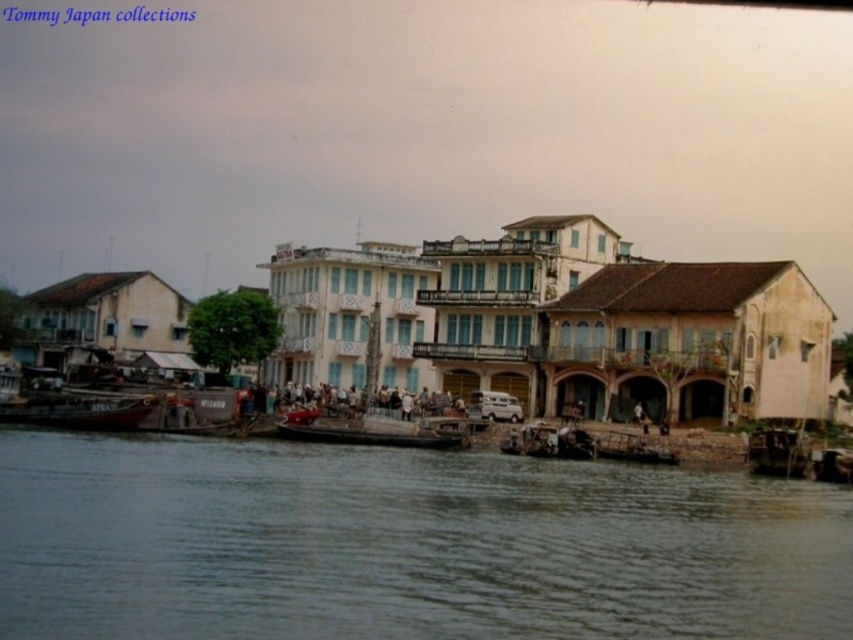
You are standing on the dock and see the wooden boat at center. Can you reach the point at (364,432) on the wooden boat at center without getting wet?

The point at (364,432) is on the wooden boat at center, so yes, you can reach it without getting wet as it is on the boat itself.

You are standing on the riverside and see the brown water at lower center and the wooden boat at center. Which object is closer to the river surface?

The brown water at lower center is located below the wooden boat at center, so the wooden boat at center is closer to the river surface.

You are standing at the riverside and want to take a photo of the central building. To avoid including the brown water at lower center in your photo, where should you position yourself relative to the central building?

To avoid including the brown water at lower center in your photo, you should position yourself to the left or right of the central building, as the brown water at lower center is located at point coordinates that might be in the center of the frame if you stand directly in front of the central building.